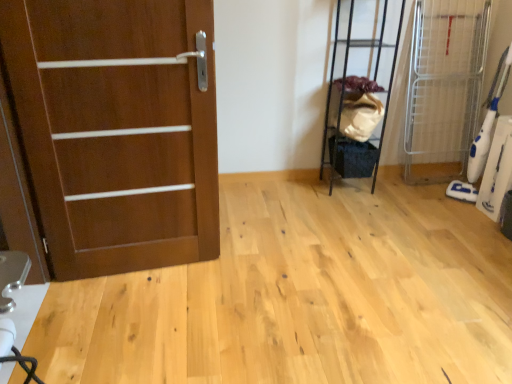
Question: From the image's perspective, is white plastic vacuum cleaner at right, which ranks as the 2th elevator in left-to-right order, located above or below black metal shelf at upper right, arranged as the 1th elevator when viewed from the left?

Choices:
 (A) above
 (B) below

Answer: (B)

Question: Considering the positions of white plastic vacuum cleaner at right, which ranks as the 2th elevator in left-to-right order, and black metal shelf at upper right, which ranks as the second elevator in right-to-left order, in the image, is white plastic vacuum cleaner at right, which ranks as the 2th elevator in left-to-right order, bigger or smaller than black metal shelf at upper right, which ranks as the second elevator in right-to-left order,?

Choices:
 (A) small
 (B) big

Answer: (A)

Question: Considering the real-world distances, which object is closest to the black metal shelf at upper right, arranged as the 1th elevator when viewed from the left?

Choices:
 (A) white plastic vacuum cleaner at right, which is counted as the first elevator, starting from the right
 (B) matte wood door at left

Answer: (A)

Question: Which is nearer to the matte wood door at left?

Choices:
 (A) white plastic vacuum cleaner at right, which is counted as the first elevator, starting from the right
 (B) black metal shelf at upper right, arranged as the 1th elevator when viewed from the left

Answer: (B)